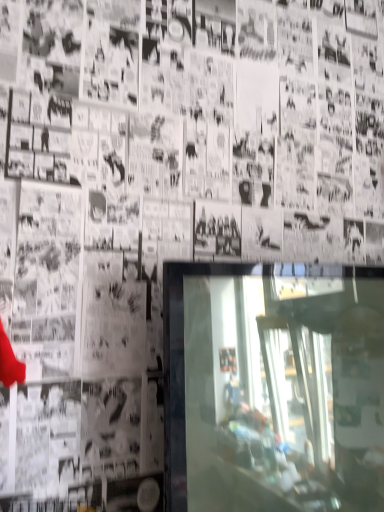
Locate an element on the screen. This screenshot has height=512, width=384. transparent glass tv at center is located at coordinates (271, 392).

Describe the element at coordinates (271, 392) in the screenshot. I see `transparent glass tv at center` at that location.

Locate an element on the screen. transparent glass tv at center is located at coordinates (271, 392).